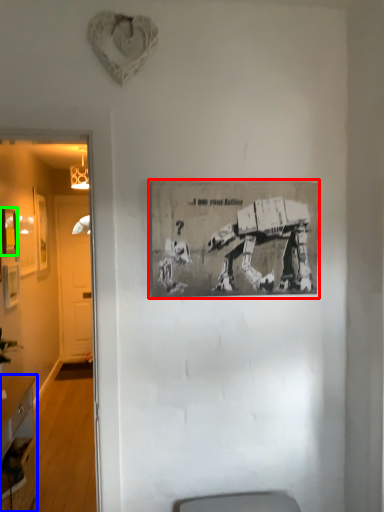
Question: Which object is positioned closest to picture frame (highlighted by a red box)? Select from desk (highlighted by a blue box) and picture frame (highlighted by a green box).

Choices:
 (A) desk
 (B) picture frame

Answer: (A)